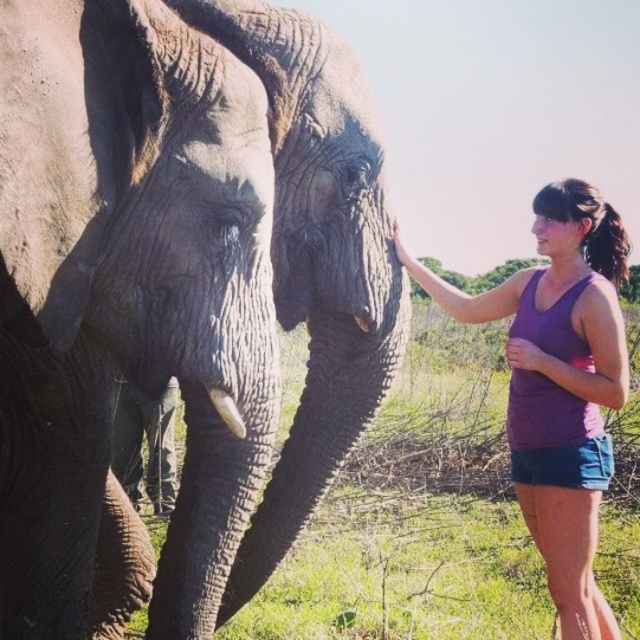
Is purple fabric tank top at upper right above white ivory tusk at lower left?

Actually, purple fabric tank top at upper right is below white ivory tusk at lower left.

Does purple fabric tank top at upper right appear under white ivory tusk at lower left?

Yes, purple fabric tank top at upper right is below white ivory tusk at lower left.

Between point (534, 221) and point (221, 406), which one is positioned in front?

Positioned in front is point (221, 406).

You are a GUI agent. You are given a task and a screenshot of the screen. Output one action in this format:
    pyautogui.click(x=<x>, y=<y>)
    Task: Click on the purple fabric tank top at upper right
    The image size is (640, 640).
    Given the screenshot: What is the action you would take?
    pyautogui.click(x=560, y=384)

Is gray rough skin elephant at center smaller than white ivory tusk at lower left?

Incorrect, gray rough skin elephant at center is not smaller in size than white ivory tusk at lower left.

Is gray rough skin elephant at center closer to camera compared to white ivory tusk at lower left?

Yes.

Identify the location of gray rough skin elephant at center. The width and height of the screenshot is (640, 640). (179, 284).

Locate an element on the screen. This screenshot has height=640, width=640. gray rough skin elephant at center is located at coordinates (179, 284).

Is gray rough skin elephant at center below purple fabric tank top at upper right?

No.

Does point (77, 289) come in front of point (541, 538)?

Yes, it is in front of point (541, 538).

Where is `gray rough skin elephant at center`? gray rough skin elephant at center is located at coordinates (179, 284).